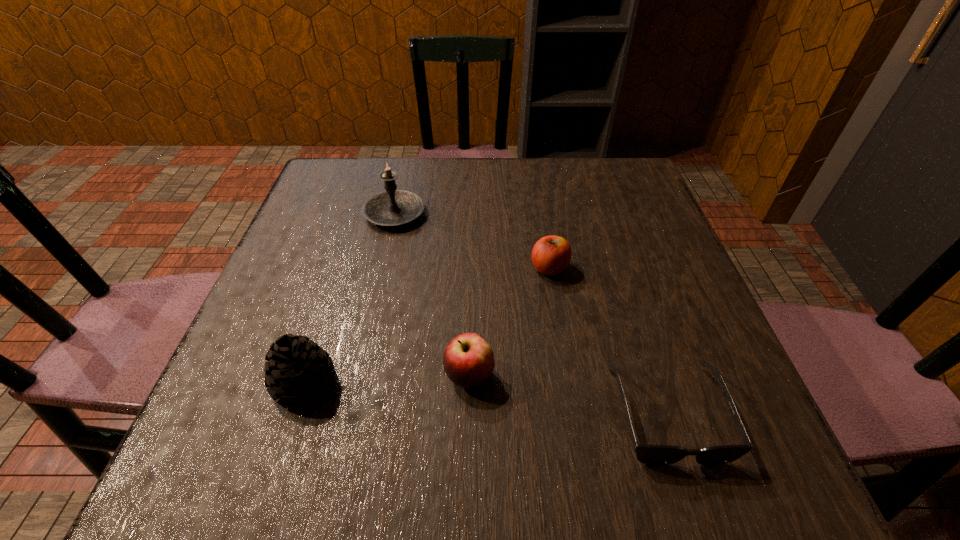
Where is `free space located 0.240m at the narrow end of the pinecone`? Image resolution: width=960 pixels, height=540 pixels. free space located 0.240m at the narrow end of the pinecone is located at coordinates (482, 383).

At what (x,y) coordinates should I click in order to perform the action: click on vacant space located 0.160m on the back of the third object from right to left. Please return your answer as a coordinate pair (x, y). This screenshot has width=960, height=540. Looking at the image, I should click on coord(471,288).

Locate an element on the screen. This screenshot has width=960, height=540. vacant space located 0.190m on the front of the second object from right to left is located at coordinates (564, 360).

Identify the location of object present at the far edge. (392, 207).

Where is `object present at the near edge`? object present at the near edge is located at coordinates (647, 454).

In order to click on candle located in the left edge section of the desktop in this screenshot , I will do `click(392, 207)`.

I want to click on pinecone that is at the left edge, so click(297, 370).

Identify the location of object present at the right edge. The width and height of the screenshot is (960, 540). (647, 454).

Locate an element on the screen. This screenshot has height=540, width=960. object situated at the far left corner is located at coordinates (392, 207).

This screenshot has width=960, height=540. Find the location of `object located at the near right corner`. object located at the near right corner is located at coordinates (647, 454).